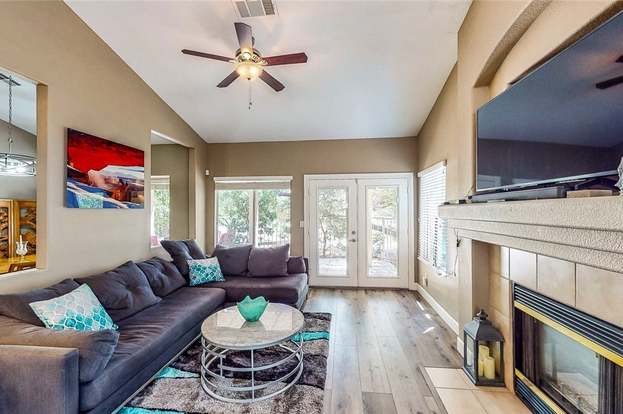
At what (x,y) coordinates should I click in order to perform the action: click on tv. Please return your answer as a coordinate pair (x, y). Looking at the image, I should click on (506, 161).